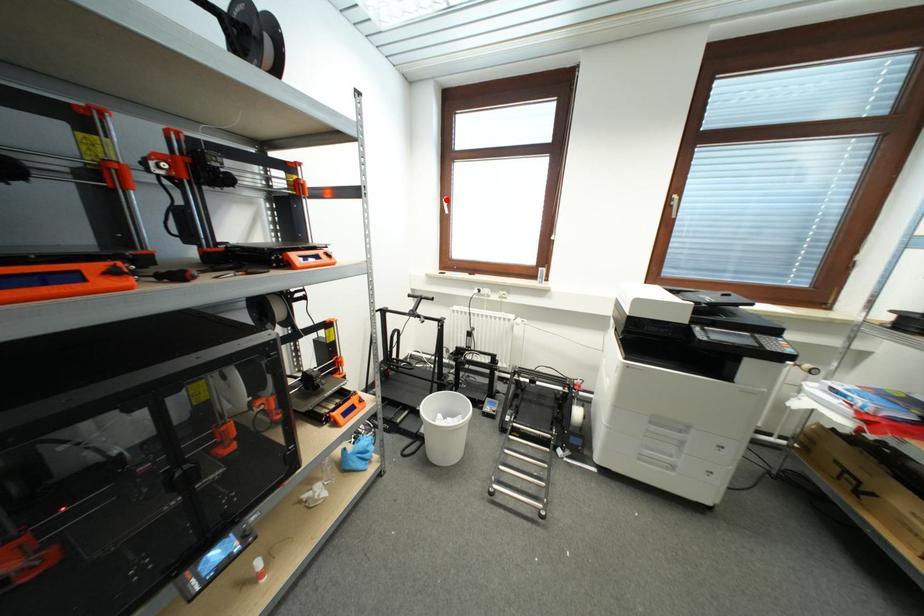
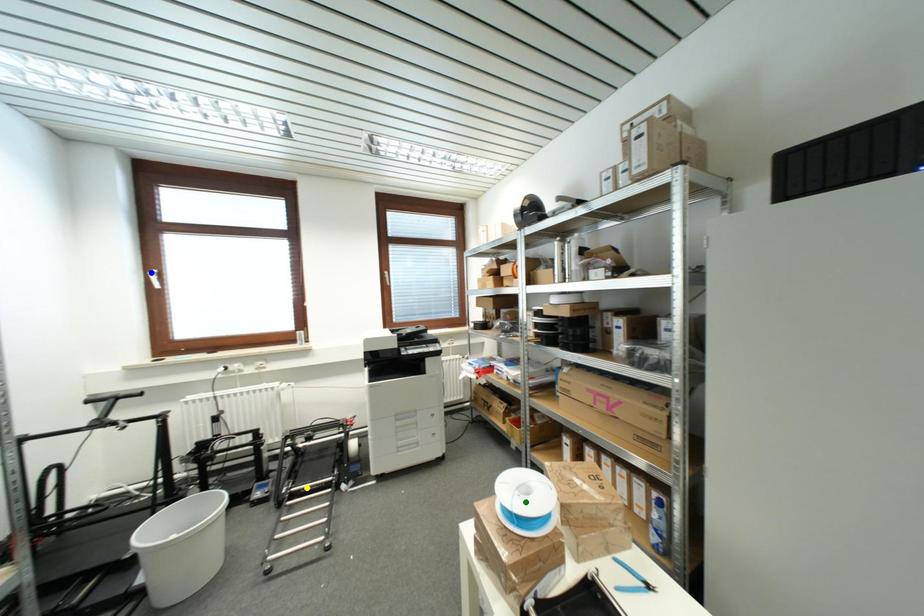
Question: I am providing you with two images of the same scene from different viewpoints. A red point is marked on the first image. You are given multiple points on the second image. Which mark in image 2 goes with the point in image 1?

Choices:
 (A) blue point
 (B) yellow point
 (C) green point

Answer: (A)